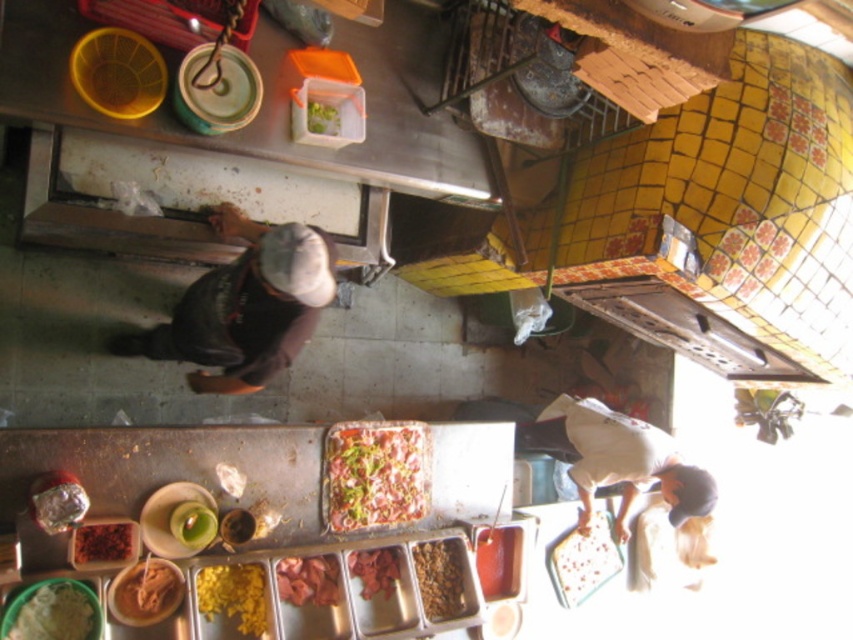
You are a food safety inspector checking the kitchen. You notice the dark brown fabric at center and the raw meat at center are both on the counter. According to food safety guidelines, which item should be placed higher to prevent cross contamination?

The dark brown fabric at center should be placed higher than the raw meat at center because it already has a greater height, which helps prevent juices from the raw meat from dripping onto it and causing contamination.

You are a chef looking down at the kitchen counter and notice two points marked on the counter. The first point is at coordinate point (x=32, y=634) and the second is at point (x=299, y=602). From your viewpoint, which point is closer to you?

Point (x=32, y=634) is closer to the camera than point (x=299, y=602), so the first point is closer to you.